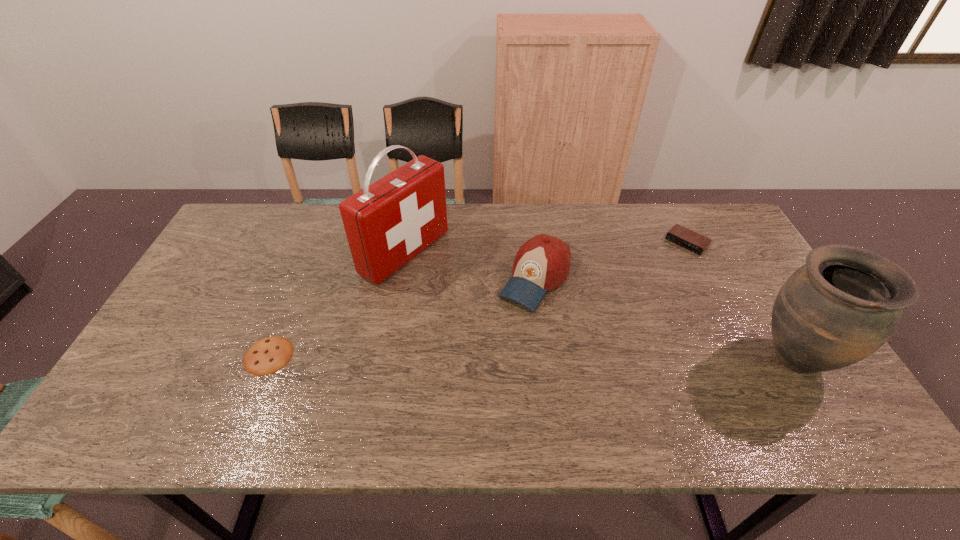
Locate an element on the screen. The width and height of the screenshot is (960, 540). cookie is located at coordinates (266, 356).

You are a GUI agent. You are given a task and a screenshot of the screen. Output one action in this format:
    pyautogui.click(x=<x>, y=<y>)
    Task: Click on the shortest object
    The height and width of the screenshot is (540, 960).
    Given the screenshot: What is the action you would take?
    point(266,356)

Locate an element on the screen. The image size is (960, 540). urn is located at coordinates (840, 307).

What are the coordinates of `the third shortest object` in the screenshot? It's located at (542, 263).

Where is `the third object from left to right`? the third object from left to right is located at coordinates (542, 263).

Where is `the first-aid kit`? the first-aid kit is located at coordinates [x=387, y=223].

The height and width of the screenshot is (540, 960). In order to click on the tallest object in this screenshot , I will do `click(387, 223)`.

In order to click on alarm clock in this screenshot , I will do `click(684, 237)`.

Locate an element on the screen. The width and height of the screenshot is (960, 540). blank space located 0.210m on the back of the leftmost object is located at coordinates (300, 280).

In order to click on free spot located on the left of the urn in this screenshot , I will do `click(731, 358)`.